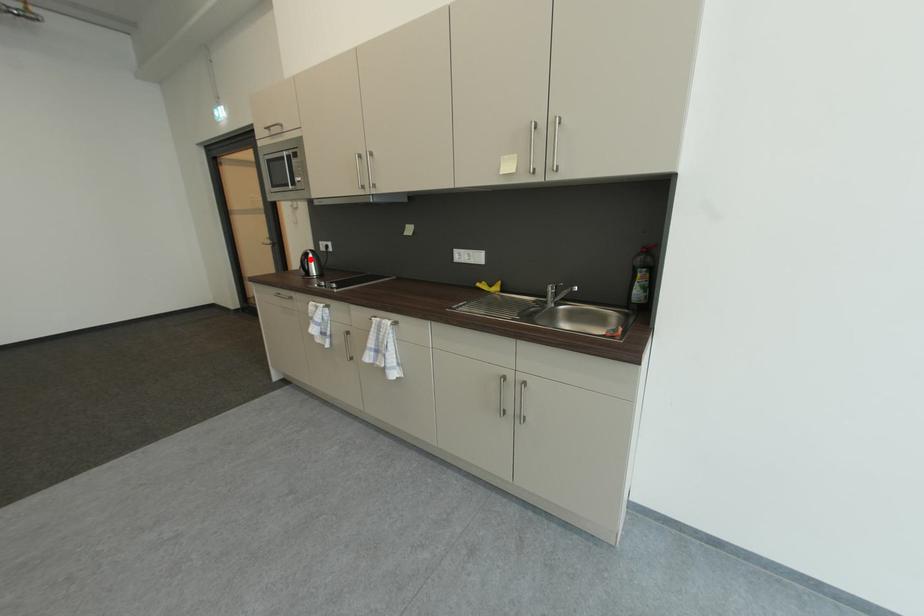
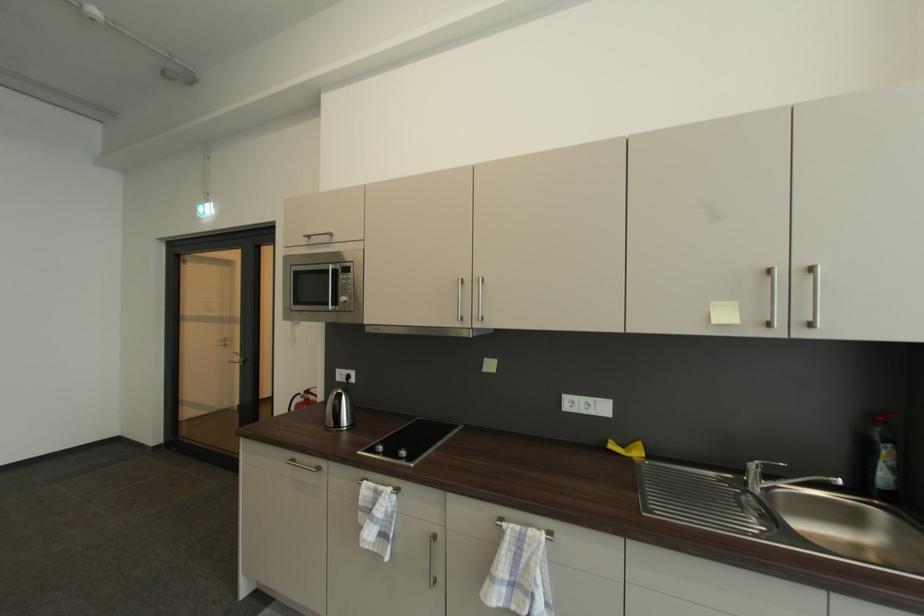
The point at the highlighted location is marked in the first image. Where is the corresponding point in the second image?

(344, 403)